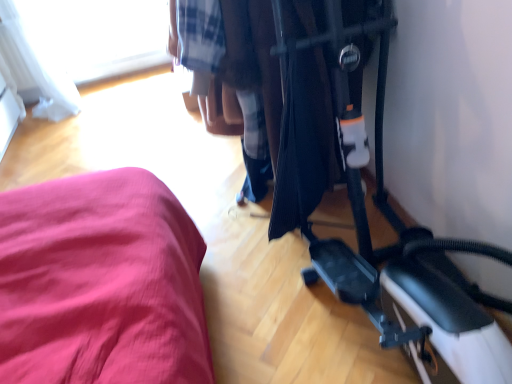
What are the coordinates of `free point below transparent glass window at upper left (from a real-world perspective)` in the screenshot? It's located at (112, 76).